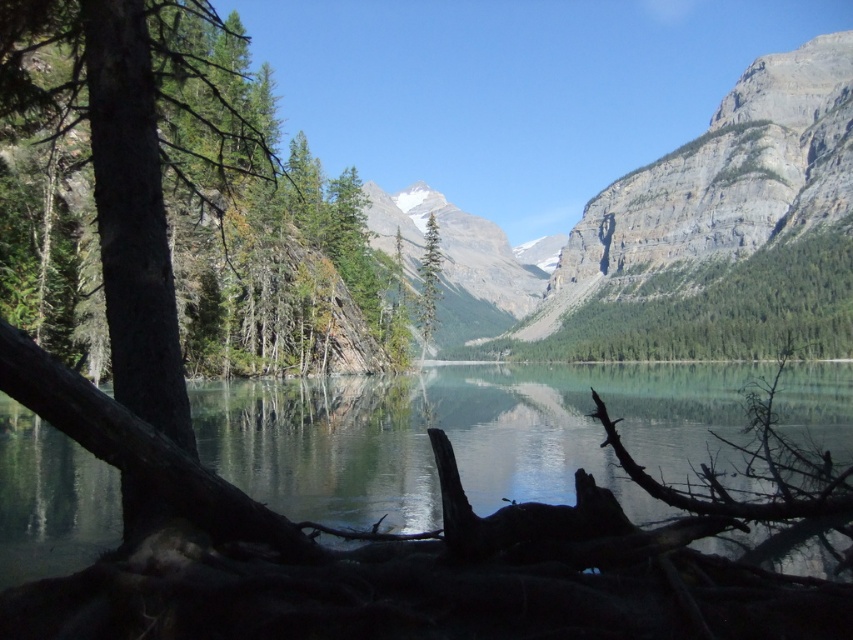
Question: Is clear glass water at center to the left of white snow-covered mountain at center from the viewer's perspective?

Choices:
 (A) yes
 (B) no

Answer: (B)

Question: Does white snow-covered mountain at center have a larger size compared to green matte tree at center?

Choices:
 (A) yes
 (B) no

Answer: (A)

Question: Which object appears farthest from the camera in this image?

Choices:
 (A) white snow-covered mountain at center
 (B) green matte tree at center

Answer: (A)

Question: Which point is farther to the camera?

Choices:
 (A) (241, 426)
 (B) (480, 225)
 (C) (422, 308)

Answer: (B)

Question: Estimate the real-world distances between objects in this image. Which object is farther from the green matte tree at center?

Choices:
 (A) clear glass water at center
 (B) white snow-covered mountain at center

Answer: (B)

Question: Can you confirm if clear glass water at center is bigger than green matte tree at center?

Choices:
 (A) yes
 (B) no

Answer: (A)